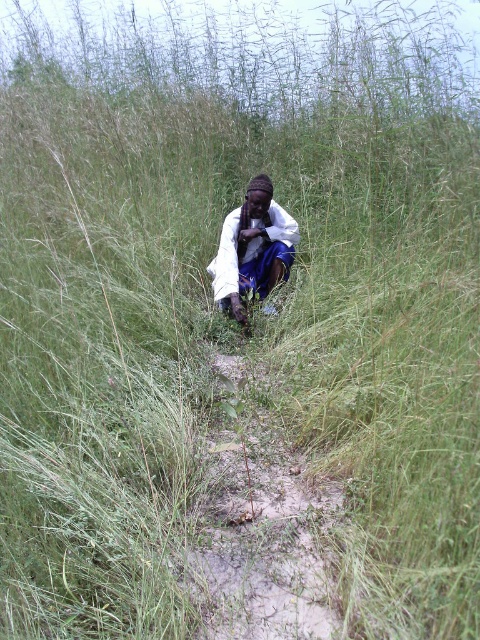
Which is more to the left, dirt path at center or white matte shirt at center?

Positioned to the left is white matte shirt at center.

Does dirt path at center have a lesser width compared to white matte shirt at center?

Yes.

Is point (309, 612) less distant than point (235, 310)?

Yes, point (309, 612) is closer to viewer.

Locate an element on the screen. dirt path at center is located at coordinates (260, 524).